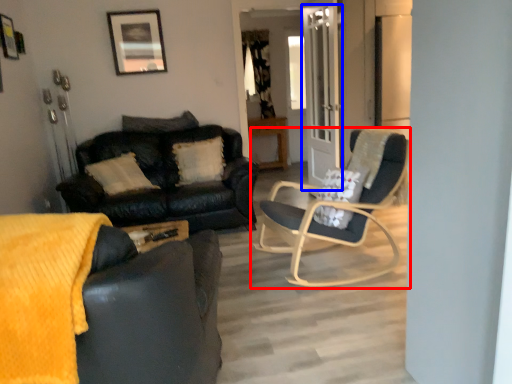
Question: Which object appears closest to the camera in this image, chair (highlighted by a red box) or glass door (highlighted by a blue box)?

Choices:
 (A) chair
 (B) glass door

Answer: (A)